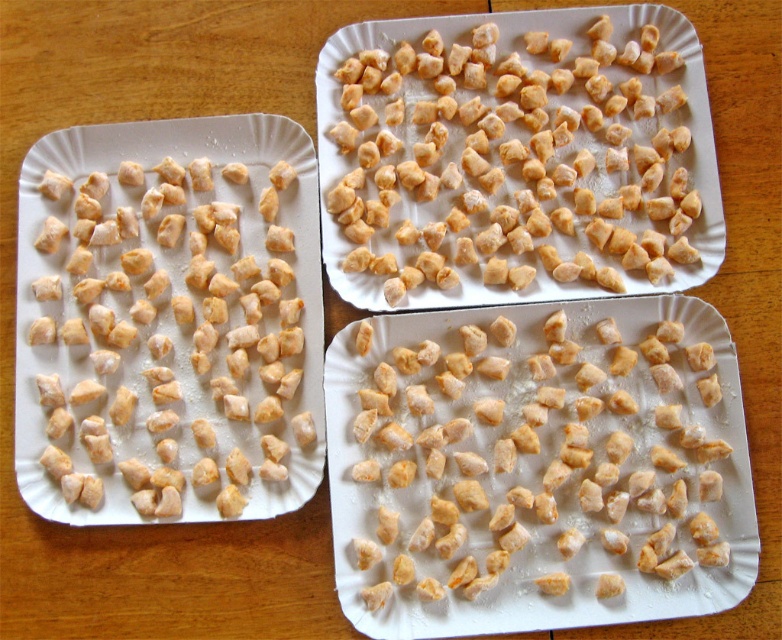
Who is more forward, (x=447, y=154) or (x=63, y=376)?

Point (x=63, y=376)

This screenshot has height=640, width=782. Describe the element at coordinates (515, 156) in the screenshot. I see `golden brown croutons at center` at that location.

You are a GUI agent. You are given a task and a screenshot of the screen. Output one action in this format:
    pyautogui.click(x=<x>, y=<y>)
    Task: Click on the golden brown croutons at center
    
    Given the screenshot: What is the action you would take?
    pyautogui.click(x=515, y=156)

Is golden brown crumbly at center bigger than golden brown croutons at center?

Correct, golden brown crumbly at center is larger in size than golden brown croutons at center.

Consider the image. Can you confirm if golden brown crumbly at center is wider than golden brown croutons at center?

A: Incorrect, golden brown crumbly at center's width does not surpass golden brown croutons at center's.

Does point (719, 605) come behind point (723, 244)?

No.

Find the location of `golden brown crumbly at center`. golden brown crumbly at center is located at coordinates (535, 461).

Between golden brown crumbly at center and light brown dough at left, which one is positioned lower?

golden brown crumbly at center

Is point (475, 573) farther from camera compared to point (241, 330)?

No, it is in front of (241, 330).

Does point (456, 525) come farther from viewer compared to point (285, 438)?

No, it is in front of (285, 438).

Where is `golden brown crumbly at center`? This screenshot has height=640, width=782. golden brown crumbly at center is located at coordinates (535, 461).